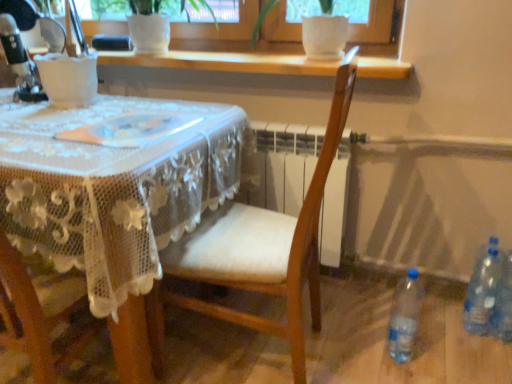
You are a GUI agent. You are given a task and a screenshot of the screen. Output one action in this format:
    pyautogui.click(x=<x>, y=<y>)
    Task: Click on the vacant area that lies to the right of wooden chair at center
    The height and width of the screenshot is (384, 512).
    Given the screenshot: What is the action you would take?
    [x=371, y=339]